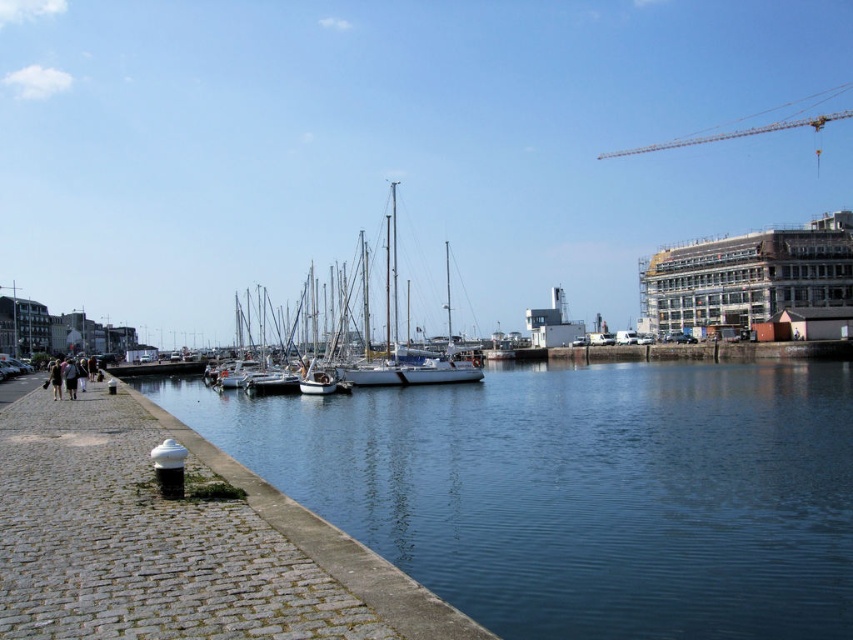
Consider the image. You are standing on the cobblestone walkway and want to take a photo of the white glossy sailboat at center. To avoid including the blue smooth water at lower left in your shot, where should you position yourself relative to the sailboat?

You should position yourself behind the white glossy sailboat at center so that the blue smooth water at lower left is out of the frame, as the water is located below the sailboat.

Consider the image. You are standing on the cobblestone walkway and want to take a photo of the blue smooth water at lower left and the white glossy sailboat at center. Which object should you focus on first to ensure both are in sharp focus?

You should focus on the blue smooth water at lower left first since it is closer to the viewer than the white glossy sailboat at center, ensuring both will be in focus when using depth of field properly.